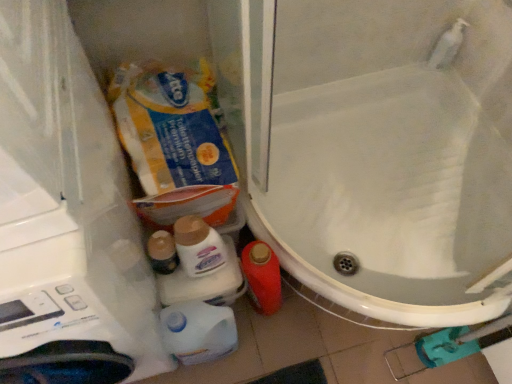
Question: Would you say yellow cardboard toilet paper at upper left is outside white glossy bottle at lower center, which ranks as the second cleaning product in top-to-bottom order?

Choices:
 (A) no
 (B) yes

Answer: (B)

Question: From a real-world perspective, is yellow cardboard toilet paper at upper left located beneath white glossy bottle at lower center, which appears as the first cleaning product when ordered from the bottom?

Choices:
 (A) yes
 (B) no

Answer: (B)

Question: Does yellow cardboard toilet paper at upper left turn towards white glossy bottle at lower center, which appears as the first cleaning product when ordered from the bottom?

Choices:
 (A) no
 (B) yes

Answer: (B)

Question: Does yellow cardboard toilet paper at upper left touch white glossy bottle at lower center, which appears as the first cleaning product when ordered from the bottom?

Choices:
 (A) yes
 (B) no

Answer: (B)

Question: Is yellow cardboard toilet paper at upper left not near white glossy bottle at lower center, which appears as the first cleaning product when ordered from the bottom?

Choices:
 (A) no
 (B) yes

Answer: (A)

Question: Is yellow cardboard toilet paper at upper left turned away from white glossy bottle at lower center, which ranks as the second cleaning product in top-to-bottom order?

Choices:
 (A) no
 (B) yes

Answer: (A)

Question: From the image's perspective, is yellow cardboard toilet paper at upper left beneath white glossy toilet at lower left?

Choices:
 (A) yes
 (B) no

Answer: (B)

Question: Is yellow cardboard toilet paper at upper left in front of white glossy toilet at lower left?

Choices:
 (A) no
 (B) yes

Answer: (B)

Question: Could white glossy toilet at lower left be considered to be inside yellow cardboard toilet paper at upper left?

Choices:
 (A) yes
 (B) no

Answer: (B)

Question: Considering the relative sizes of yellow cardboard toilet paper at upper left and white glossy toilet at lower left in the image provided, is yellow cardboard toilet paper at upper left wider than white glossy toilet at lower left?

Choices:
 (A) yes
 (B) no

Answer: (B)

Question: Is yellow cardboard toilet paper at upper left facing away from white glossy toilet at lower left?

Choices:
 (A) no
 (B) yes

Answer: (A)

Question: Considering the relative positions of yellow cardboard toilet paper at upper left and white glossy toilet at lower left in the image provided, is yellow cardboard toilet paper at upper left to the left of white glossy toilet at lower left from the viewer's perspective?

Choices:
 (A) yes
 (B) no

Answer: (A)

Question: Is white glossy bottle at lower center, which ranks as the second cleaning product in top-to-bottom order, aimed at yellow cardboard toilet paper at upper left?

Choices:
 (A) no
 (B) yes

Answer: (A)